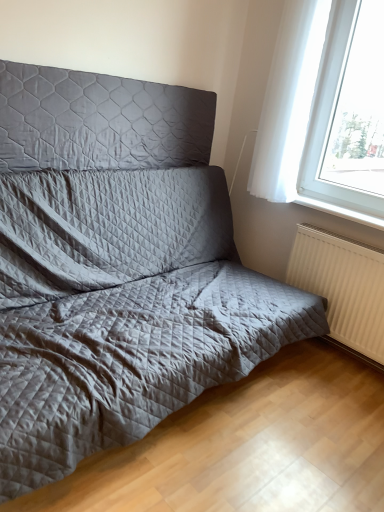
Question: Can you confirm if white glossy window sill at lower right is positioned to the left of quilted fabric headboard at upper left?

Choices:
 (A) yes
 (B) no

Answer: (B)

Question: Could you tell me if white glossy window sill at lower right is facing quilted fabric headboard at upper left?

Choices:
 (A) yes
 (B) no

Answer: (B)

Question: Is white glossy window sill at lower right oriented away from quilted fabric headboard at upper left?

Choices:
 (A) no
 (B) yes

Answer: (A)

Question: Is white glossy window sill at lower right located outside quilted fabric headboard at upper left?

Choices:
 (A) yes
 (B) no

Answer: (A)

Question: Is white glossy window sill at lower right bigger than quilted fabric headboard at upper left?

Choices:
 (A) yes
 (B) no

Answer: (B)

Question: Are white glossy window sill at lower right and quilted fabric headboard at upper left making contact?

Choices:
 (A) no
 (B) yes

Answer: (A)

Question: Could you tell me if white sheer curtain at upper right is facing white textured radiator at lower right?

Choices:
 (A) no
 (B) yes

Answer: (A)

Question: From a real-world perspective, is white sheer curtain at upper right physically below white textured radiator at lower right?

Choices:
 (A) no
 (B) yes

Answer: (A)

Question: From a real-world perspective, does white sheer curtain at upper right stand above white textured radiator at lower right?

Choices:
 (A) yes
 (B) no

Answer: (A)

Question: Considering the relative sizes of white sheer curtain at upper right and white textured radiator at lower right in the image provided, is white sheer curtain at upper right taller than white textured radiator at lower right?

Choices:
 (A) no
 (B) yes

Answer: (B)

Question: Is white sheer curtain at upper right at the right side of white textured radiator at lower right?

Choices:
 (A) yes
 (B) no

Answer: (A)

Question: Does white sheer curtain at upper right have a larger size compared to white textured radiator at lower right?

Choices:
 (A) no
 (B) yes

Answer: (B)

Question: From the image's perspective, would you say quilted fabric headboard at upper left is positioned over white sheer curtain at upper right?

Choices:
 (A) no
 (B) yes

Answer: (A)